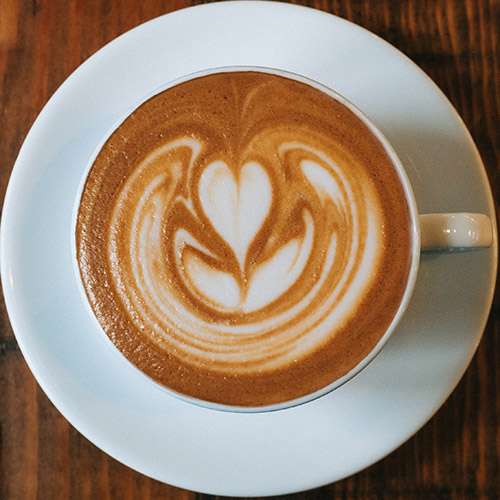
Locate an element on the screen. This screenshot has height=500, width=500. bottom side of cup is located at coordinates (234, 412).